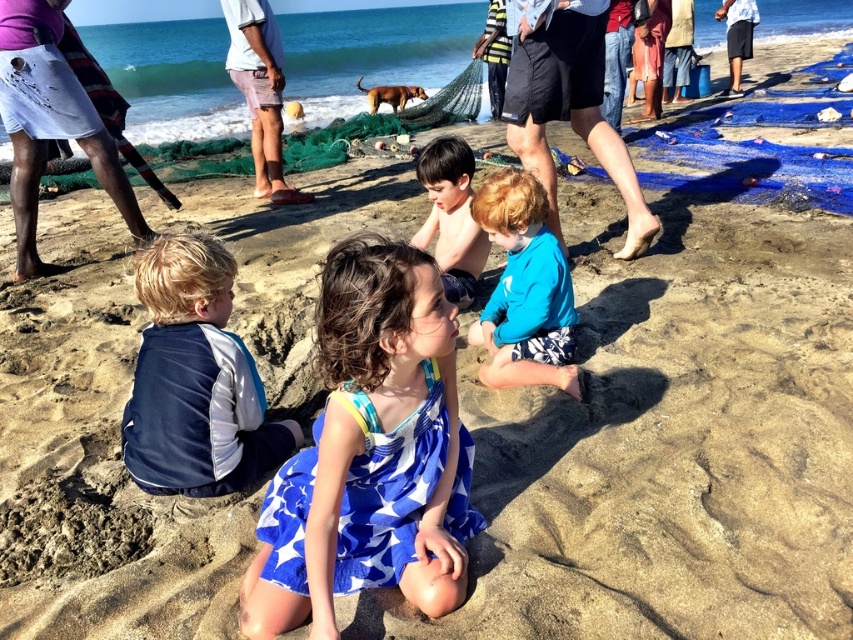
You are a photographer trying to capture a photo of the beach scene. You notice the white striped skirt at upper left and the light brown shorts at upper center. Which object should you focus on to ensure it appears larger in your photo?

Result: The white striped skirt at upper left is much taller than the light brown shorts at upper center, so focusing on the white striped skirt at upper left will make it appear larger in the photo.